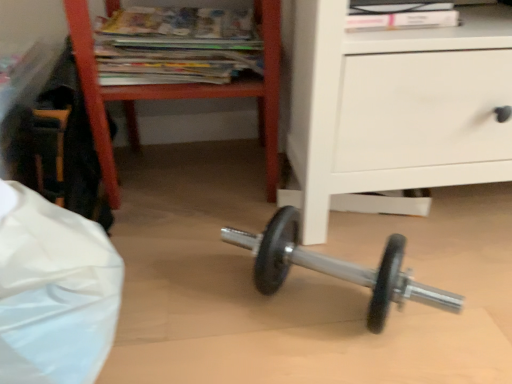
The height and width of the screenshot is (384, 512). Find the location of `vacant space underneath wooden magazine rack at upper left (from a real-world perspective)`. vacant space underneath wooden magazine rack at upper left (from a real-world perspective) is located at coordinates (201, 172).